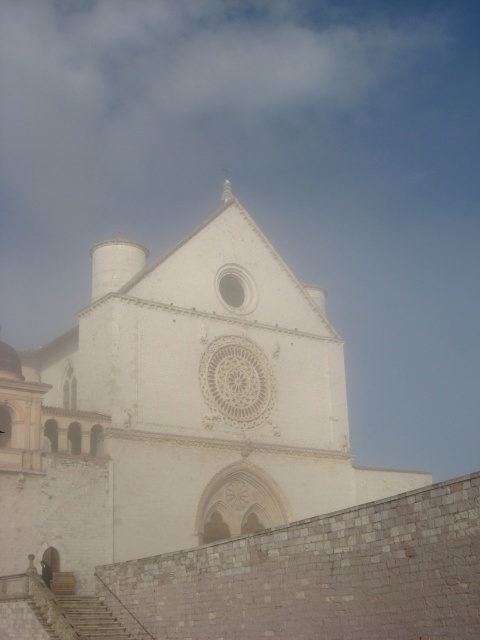
You are standing in front of a historic church with a white stone clock. The clock is located at point (237,380). Where would you look to find the white stone clock?

The white stone clock is located at point (237,380).

You are standing in front of a historic building and want to take a photo of the white stone church at center. If your camera can focus on objects up to 30 meters away, will it be able to capture the church clearly?

The white stone church at center is 30.89 meters away from the camera. Since the camera can focus up to 30 meters, it cannot capture the church clearly as it is slightly beyond the maximum focusing distance.

You are an architect analyzing the structure of the white stone church at center and the white stone spire at upper center. Which object occupies a greater area in the image?

The white stone church at center is larger in size than the white stone spire at upper center, so it occupies a greater area in the image.